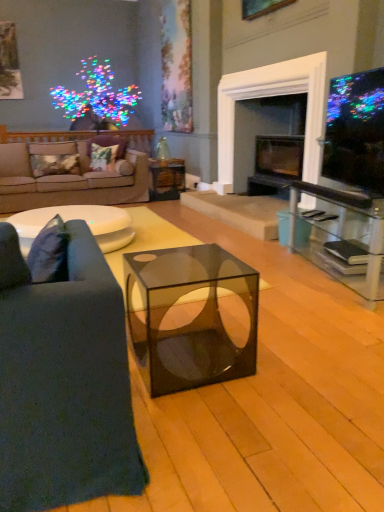
Question: Visually, is transparent glass cube at center positioned to the left or to the right of translucent glass cube at center?

Choices:
 (A) left
 (B) right

Answer: (B)

Question: Is transparent glass cube at center taller or shorter than translucent glass cube at center?

Choices:
 (A) tall
 (B) short

Answer: (A)

Question: Which object is the closest to the white glossy coffee table at center?

Choices:
 (A) floral fabric pillow at center, the first pillow in the right-to-left sequence
 (B) velvet floral pillow at center, which is the second pillow from left to right
 (C) translucent glass cube at center
 (D) dark blue fabric couch at left, arranged as the 1th studio couch when ordered from the bottom
 (E) clear glass entertainment center at right

Answer: (C)

Question: Which is nearer to the transparent glass cube at center?

Choices:
 (A) matte black tv at upper right
 (B) metallic gold pillow at left, placed as the first pillow when sorted from left to right
 (C) beige fabric couch at left, marked as the 2th studio couch in a front-to-back arrangement
 (D) dark blue fabric couch at left, arranged as the 1th studio couch when ordered from the bottom
 (E) black glass fireplace at center

Answer: (D)